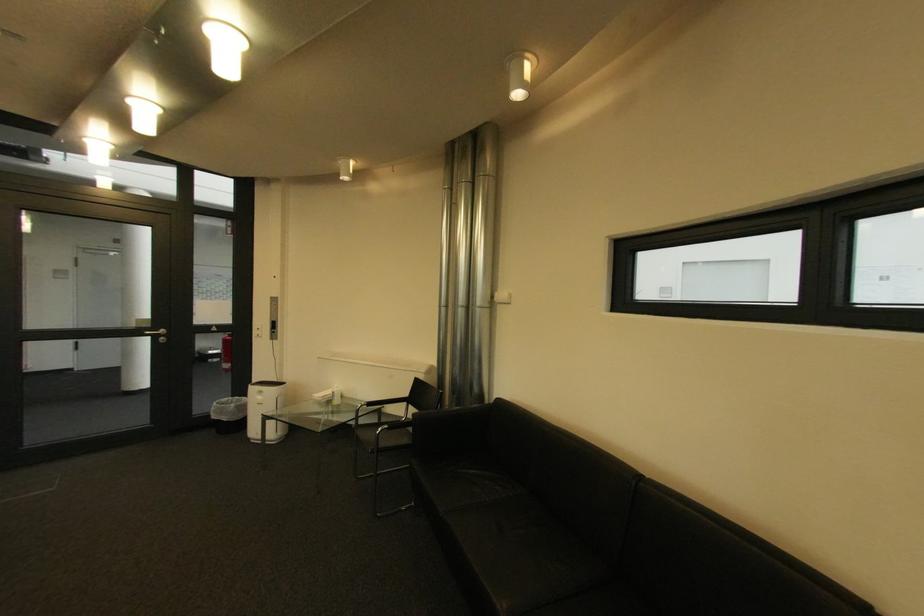
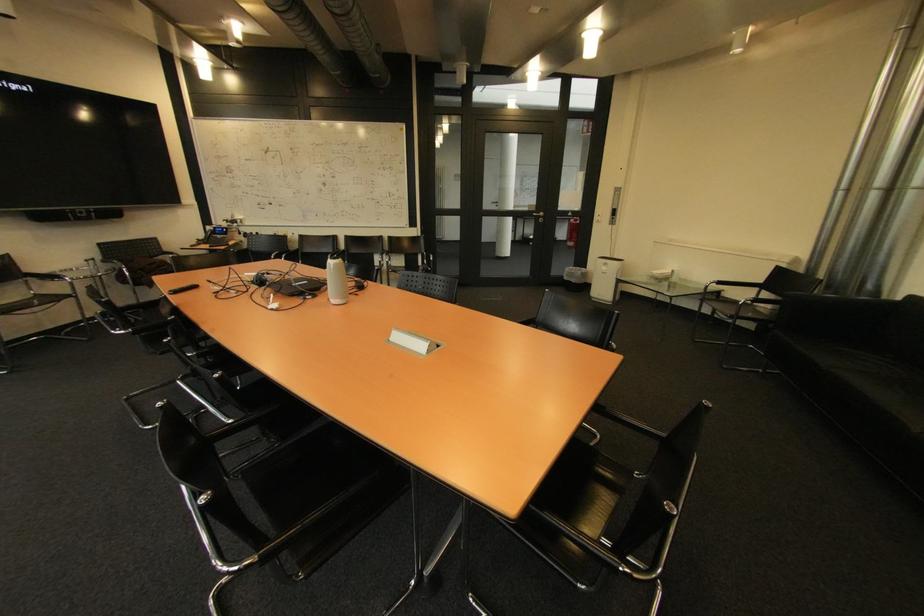
Find the pixel in the second image that matches point (156, 326) in the first image.

(542, 209)